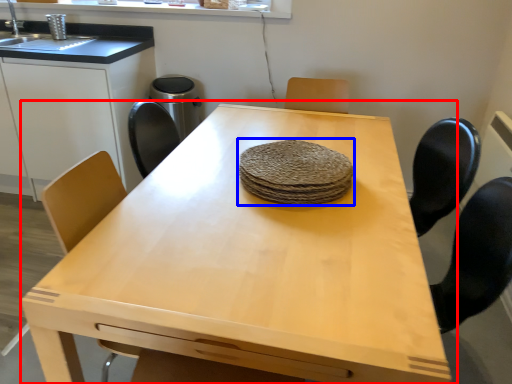
Question: Which point is closer to the camera, table (highlighted by a red box) or food (highlighted by a blue box)?

Choices:
 (A) table
 (B) food

Answer: (A)